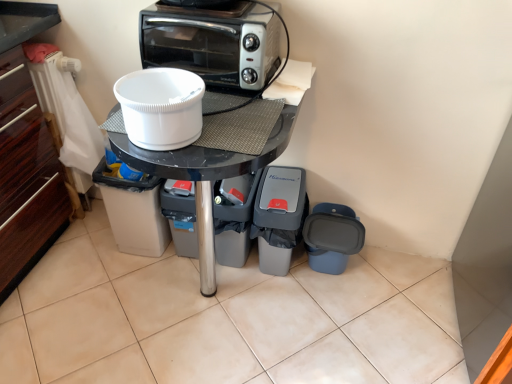
This screenshot has height=384, width=512. What are the coordinates of `empty space that is ontop of gray plastic trash can at lower center, arranged as the second appliance when viewed from the right (from a real-world perspective)` in the screenshot? It's located at (285, 180).